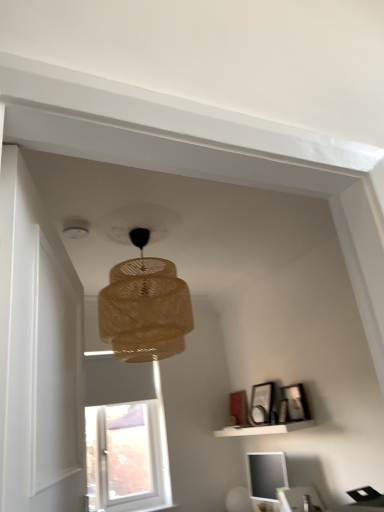
You are a GUI agent. You are given a task and a screenshot of the screen. Output one action in this format:
    pyautogui.click(x=<x>, y=<y>)
    Task: Click on the white matte shelf at lower right
    This screenshot has height=512, width=384.
    Given the screenshot: What is the action you would take?
    pyautogui.click(x=264, y=429)

Image resolution: width=384 pixels, height=512 pixels. Find the location of `matte black picture frame at upper right, the 1th picture frame positioned from the left`. matte black picture frame at upper right, the 1th picture frame positioned from the left is located at coordinates (261, 403).

Identify the location of white wooden door at left. (37, 353).

From the image's perspective, which is below, matte black monitor at lower right or matte black picture frame at upper right, positioned as the second picture frame in left-to-right order?

matte black monitor at lower right, from the image's perspective.

Is matte black monitor at lower right looking in the opposite direction of matte black picture frame at upper right, which ranks as the 1th picture frame in right-to-left order?

No, matte black monitor at lower right is not facing away from matte black picture frame at upper right, which ranks as the 1th picture frame in right-to-left order.

Locate an element on the screen. The width and height of the screenshot is (384, 512). computer monitor on the left of matte black picture frame at upper right, which ranks as the 1th picture frame in right-to-left order is located at coordinates (266, 478).

Can you confirm if matte black monitor at lower right is positioned to the left of matte black picture frame at upper right, which ranks as the 1th picture frame in right-to-left order?

Correct, you'll find matte black monitor at lower right to the left of matte black picture frame at upper right, which ranks as the 1th picture frame in right-to-left order.

In the image, is matte black picture frame at upper right, positioned as the second picture frame in left-to-right order, on the left side or the right side of white matte shelf at lower right?

matte black picture frame at upper right, positioned as the second picture frame in left-to-right order, is positioned on white matte shelf at lower right's right side.

Is matte black picture frame at upper right, positioned as the second picture frame in left-to-right order, outside of white matte shelf at lower right?

Yes, matte black picture frame at upper right, positioned as the second picture frame in left-to-right order, is located beyond the bounds of white matte shelf at lower right.

Looking at this image, is matte black picture frame at upper right, positioned as the second picture frame in left-to-right order, placed right next to white matte shelf at lower right?

No.

You are a GUI agent. You are given a task and a screenshot of the screen. Output one action in this format:
    pyautogui.click(x=<x>, y=<y>)
    Task: Click on the shelf in front of the matte black picture frame at upper right, positioned as the second picture frame in left-to-right order
    This screenshot has width=384, height=512.
    Given the screenshot: What is the action you would take?
    pyautogui.click(x=264, y=429)

From the picture: Can you tell me how much braided wicker lampshade at center and matte black picture frame at upper right, which ranks as the 1th picture frame in right-to-left order, differ in facing direction?

The angle between the facing direction of braided wicker lampshade at center and the facing direction of matte black picture frame at upper right, which ranks as the 1th picture frame in right-to-left order, is 90.9 degrees.

How distant is braided wicker lampshade at center from matte black picture frame at upper right, positioned as the second picture frame in left-to-right order?

braided wicker lampshade at center is 5.10 feet away from matte black picture frame at upper right, positioned as the second picture frame in left-to-right order.

Identify the location of picture frame that is the 2nd one when counting rightward from the braided wicker lampshade at center. tap(295, 403).

Can you confirm if braided wicker lampshade at center is shorter than matte black picture frame at upper right, positioned as the second picture frame in left-to-right order?

No.

Where is `door to the left of matte black picture frame at upper right, which ranks as the 1th picture frame in right-to-left order`? This screenshot has height=512, width=384. door to the left of matte black picture frame at upper right, which ranks as the 1th picture frame in right-to-left order is located at coordinates (37, 353).

Is white wooden door at left not inside matte black picture frame at upper right, which ranks as the 1th picture frame in right-to-left order?

white wooden door at left lies outside matte black picture frame at upper right, which ranks as the 1th picture frame in right-to-left order,'s area.

How distant is white wooden door at left from matte black picture frame at upper right, which ranks as the 1th picture frame in right-to-left order?

white wooden door at left and matte black picture frame at upper right, which ranks as the 1th picture frame in right-to-left order, are 2.61 meters apart.

Can you confirm if white wooden door at left is shorter than matte black picture frame at upper right, which ranks as the 1th picture frame in right-to-left order?

Incorrect, the height of white wooden door at left does not fall short of that of matte black picture frame at upper right, which ranks as the 1th picture frame in right-to-left order.

Can you confirm if matte black picture frame at upper right, which ranks as the 1th picture frame in right-to-left order, is smaller than white wooden door at left?

Yes, matte black picture frame at upper right, which ranks as the 1th picture frame in right-to-left order, is smaller than white wooden door at left.

Is matte black picture frame at upper right, which ranks as the 1th picture frame in right-to-left order, facing towards white wooden door at left?

No, matte black picture frame at upper right, which ranks as the 1th picture frame in right-to-left order, is not aimed at white wooden door at left.

Is matte black picture frame at upper right, positioned as the second picture frame in left-to-right order, located outside white wooden door at left?

matte black picture frame at upper right, positioned as the second picture frame in left-to-right order, is positioned outside white wooden door at left.

Looking at their sizes, would you say matte black picture frame at upper right, which ranks as the 1th picture frame in right-to-left order, is wider or thinner than white wooden door at left?

Clearly, matte black picture frame at upper right, which ranks as the 1th picture frame in right-to-left order, has more width compared to white wooden door at left.

In the scene shown: Is white matte shelf at lower right not close to braided wicker lampshade at center?

Indeed, white matte shelf at lower right is not near braided wicker lampshade at center.

Which object is positioned more to the left, white matte shelf at lower right or braided wicker lampshade at center?

From the viewer's perspective, braided wicker lampshade at center appears more on the left side.

Does white matte shelf at lower right have a larger size compared to braided wicker lampshade at center?

No, white matte shelf at lower right is not bigger than braided wicker lampshade at center.

From a real-world perspective, is white matte shelf at lower right physically above braided wicker lampshade at center?

Actually, white matte shelf at lower right is physically below braided wicker lampshade at center in the real world.

In terms of size, does white matte shelf at lower right appear bigger or smaller than matte black picture frame at upper right, positioned as the second picture frame in left-to-right order?

Clearly, white matte shelf at lower right is larger in size than matte black picture frame at upper right, positioned as the second picture frame in left-to-right order.

Is white matte shelf at lower right positioned far away from matte black picture frame at upper right, positioned as the second picture frame in left-to-right order?

No, white matte shelf at lower right is not far from matte black picture frame at upper right, positioned as the second picture frame in left-to-right order.

From the image's perspective, is white matte shelf at lower right positioned above or below matte black picture frame at upper right, positioned as the second picture frame in left-to-right order?

white matte shelf at lower right is below matte black picture frame at upper right, positioned as the second picture frame in left-to-right order.

Where is `computer monitor below the matte black picture frame at upper right, positioned as the second picture frame in left-to-right order (from a real-world perspective)`? The image size is (384, 512). computer monitor below the matte black picture frame at upper right, positioned as the second picture frame in left-to-right order (from a real-world perspective) is located at coordinates (266, 478).

The height and width of the screenshot is (512, 384). Identify the location of shelf that appears below the matte black picture frame at upper right, positioned as the second picture frame in left-to-right order (from the image's perspective). (264, 429).

Looking at the image, which one is located closer to braided wicker lampshade at center, matte black picture frame at upper right, the 1th picture frame positioned from the left, or white wooden door at left?

Based on the image, white wooden door at left appears to be nearer to braided wicker lampshade at center.

Consider the image. When comparing their distances from white matte shelf at lower right, does matte black monitor at lower right or braided wicker lampshade at center seem closer?

matte black monitor at lower right is closer to white matte shelf at lower right.

Estimate the real-world distances between objects in this image. Which object is further from matte black picture frame at upper right, placed as the 2th picture frame when sorted from right to left, matte black monitor at lower right or white wooden door at left?

Based on the image, white wooden door at left appears to be further to matte black picture frame at upper right, placed as the 2th picture frame when sorted from right to left.

From the image, which object appears to be farther from white wooden door at left, matte black picture frame at upper right, positioned as the second picture frame in left-to-right order, or white matte shelf at lower right?

The object further to white wooden door at left is matte black picture frame at upper right, positioned as the second picture frame in left-to-right order.

Considering their positions, is matte black monitor at lower right positioned closer to white wooden door at left than matte black picture frame at upper right, the 1th picture frame positioned from the left?

Based on the image, matte black monitor at lower right appears to be nearer to white wooden door at left.

In the scene shown: Considering their positions, is braided wicker lampshade at center positioned closer to white matte shelf at lower right than matte black picture frame at upper right, which ranks as the 1th picture frame in right-to-left order?

Among the two, matte black picture frame at upper right, which ranks as the 1th picture frame in right-to-left order, is located nearer to white matte shelf at lower right.

Which object lies nearer to the anchor point white matte shelf at lower right, braided wicker lampshade at center or matte black picture frame at upper right, placed as the 2th picture frame when sorted from right to left?

Among the two, matte black picture frame at upper right, placed as the 2th picture frame when sorted from right to left, is located nearer to white matte shelf at lower right.

Which object lies nearer to the anchor point matte black monitor at lower right, matte black picture frame at upper right, the 1th picture frame positioned from the left, or matte black picture frame at upper right, positioned as the second picture frame in left-to-right order?

matte black picture frame at upper right, the 1th picture frame positioned from the left, lies closer to matte black monitor at lower right than the other object.

You are a GUI agent. You are given a task and a screenshot of the screen. Output one action in this format:
    pyautogui.click(x=<x>, y=<y>)
    Task: Click on the shelf positioned between white wooden door at left and matte black picture frame at upper right, placed as the 2th picture frame when sorted from right to left, from near to far
    This screenshot has height=512, width=384.
    Given the screenshot: What is the action you would take?
    pyautogui.click(x=264, y=429)

The width and height of the screenshot is (384, 512). I want to click on picture frame between white matte shelf at lower right and matte black picture frame at upper right, placed as the 2th picture frame when sorted from right to left, from front to back, so click(295, 403).

The height and width of the screenshot is (512, 384). I want to click on lamp located between white wooden door at left and matte black monitor at lower right in the depth direction, so click(x=145, y=307).

Where is `shelf between braided wicker lampshade at center and matte black monitor at lower right in the vertical direction`? The height and width of the screenshot is (512, 384). shelf between braided wicker lampshade at center and matte black monitor at lower right in the vertical direction is located at coordinates (264, 429).